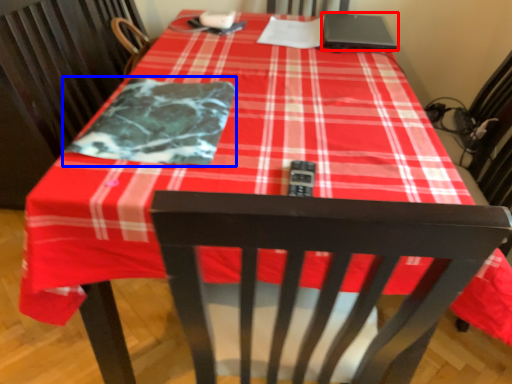
Question: Which object is further to the camera taking this photo, laptop (highlighted by a red box) or blanket (highlighted by a blue box)?

Choices:
 (A) laptop
 (B) blanket

Answer: (A)